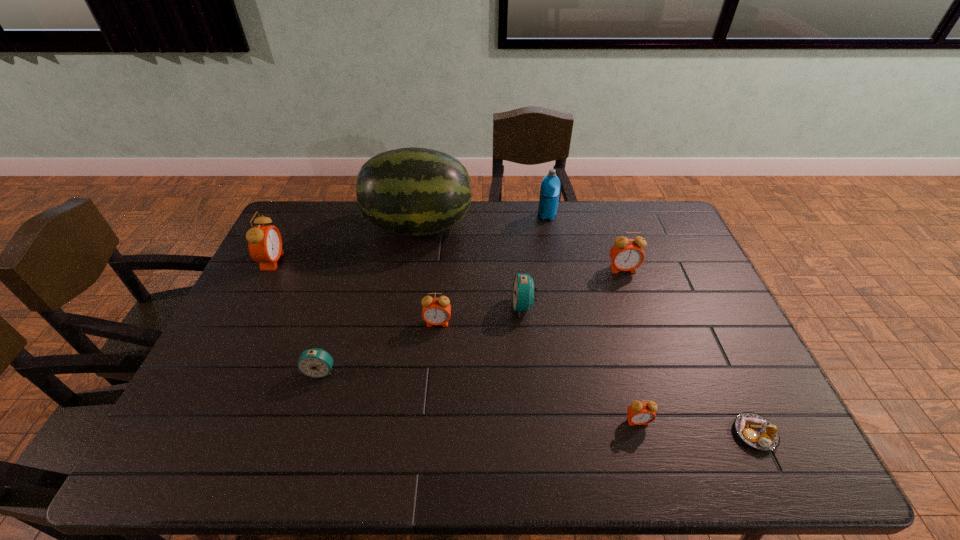
Find the location of a particular element. This screenshot has width=960, height=540. the second pink alarm clock from left to right is located at coordinates (436, 311).

You are a GUI agent. You are given a task and a screenshot of the screen. Output one action in this format:
    pyautogui.click(x=<x>, y=<y>)
    Task: Click on the nearest pink alarm clock
    
    Given the screenshot: What is the action you would take?
    pyautogui.click(x=640, y=413)

Where is `the third pink alarm clock from left to right`? This screenshot has height=540, width=960. the third pink alarm clock from left to right is located at coordinates (640, 413).

You are a GUI agent. You are given a task and a screenshot of the screen. Output one action in this format:
    pyautogui.click(x=<x>, y=<y>)
    Task: Click on the seventh farthest object
    Image resolution: width=960 pixels, height=540 pixels.
    Given the screenshot: What is the action you would take?
    pyautogui.click(x=317, y=363)

The width and height of the screenshot is (960, 540). I want to click on the fifth alarm clock from right to left, so click(317, 363).

You are a GUI agent. You are given a task and a screenshot of the screen. Output one action in this format:
    pyautogui.click(x=<x>, y=<y>)
    Task: Click on the brown pastry
    This screenshot has height=540, width=960.
    Given the screenshot: What is the action you would take?
    pyautogui.click(x=755, y=430)

Where is `pastry`? The height and width of the screenshot is (540, 960). pastry is located at coordinates (755, 430).

You are a GUI agent. You are given a task and a screenshot of the screen. Output one action in this format:
    pyautogui.click(x=<x>, y=<y>)
    Task: Click on the free space located 0.250m on the right of the watermelon
    The height and width of the screenshot is (540, 960).
    Given the screenshot: What is the action you would take?
    pyautogui.click(x=541, y=226)

You are a GUI agent. You are given a task and a screenshot of the screen. Output one action in this format:
    pyautogui.click(x=<x>, y=<y>)
    Task: Click on the free region located 0.140m on the front of the fourth object from right to left
    
    Given the screenshot: What is the action you would take?
    click(x=553, y=246)

Where is `free region located 0.060m on the face of the leftmost pink alarm clock`? The width and height of the screenshot is (960, 540). free region located 0.060m on the face of the leftmost pink alarm clock is located at coordinates (300, 261).